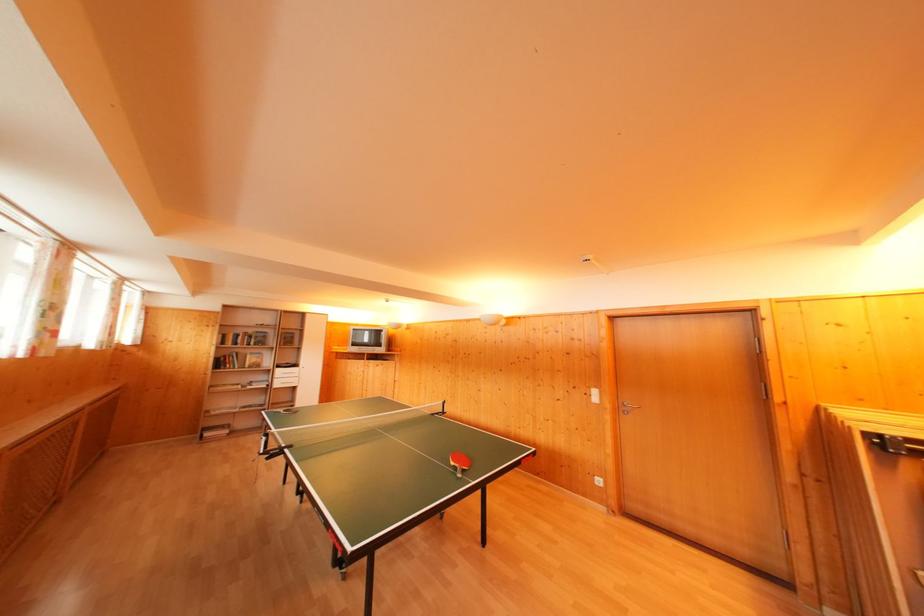
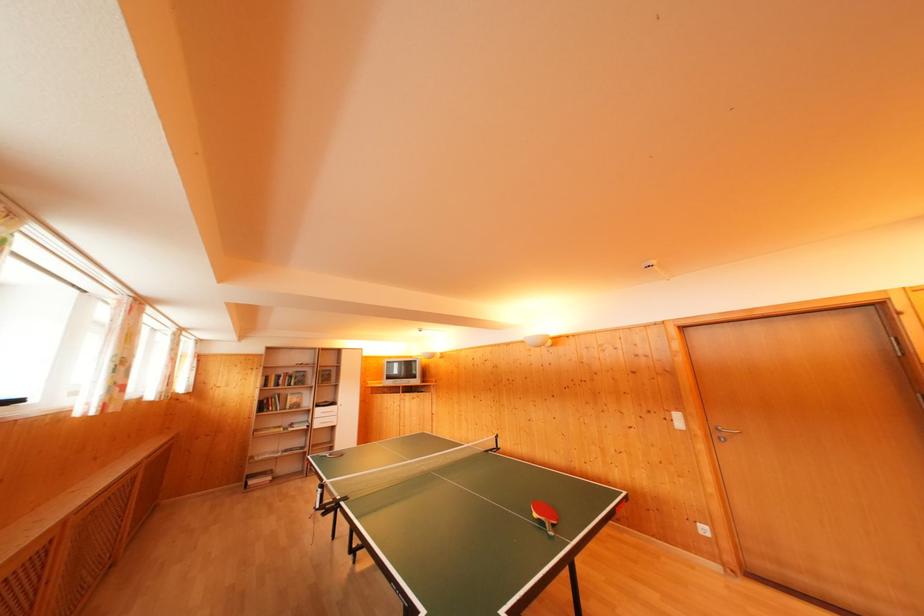
The point at (284, 376) is marked in the first image. Where is the corresponding point in the second image?

(322, 416)